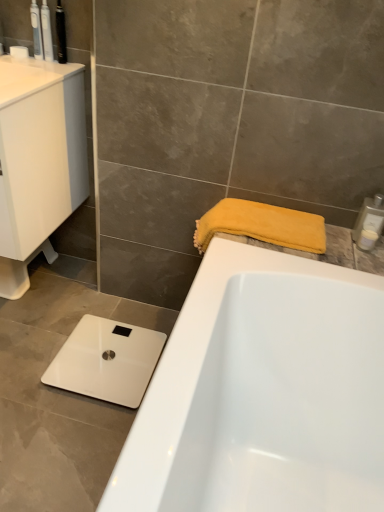
Find the location of a particular element. free space above white glossy scale at lower left (from a real-world perspective) is located at coordinates (102, 354).